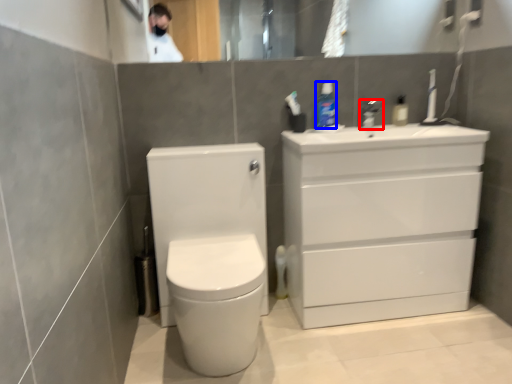
Question: Which of the following is the farthest to the observer, tap (highlighted by a red box) or toiletry (highlighted by a blue box)?

Choices:
 (A) tap
 (B) toiletry

Answer: (A)